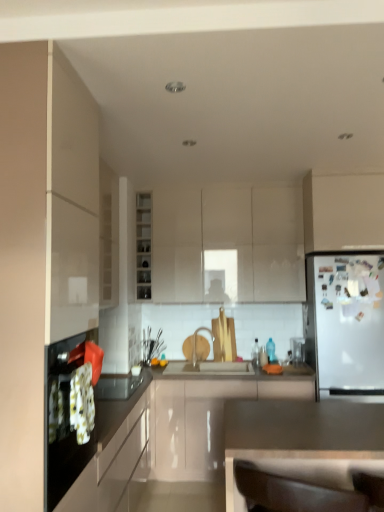
Question: Is matte white cabinet at center, the 5th cabinetry from the front, at the left side of glossy white countertop at lower center, positioned as the 1th countertop in back-to-front order?

Choices:
 (A) yes
 (B) no

Answer: (B)

Question: From a real-world perspective, is matte white cabinet at center, the 5th cabinetry from the front, located beneath glossy white countertop at lower center, positioned as the 1th countertop in back-to-front order?

Choices:
 (A) yes
 (B) no

Answer: (B)

Question: Does matte white cabinet at center, the second cabinetry in the back-to-front sequence, turn towards glossy white countertop at lower center, arranged as the 2th countertop when viewed from the front?

Choices:
 (A) yes
 (B) no

Answer: (B)

Question: From the image's perspective, is matte white cabinet at center, the 5th cabinetry from the front, below glossy white countertop at lower center, arranged as the 2th countertop when viewed from the front?

Choices:
 (A) yes
 (B) no

Answer: (B)

Question: From a real-world perspective, is matte white cabinet at center, the 5th cabinetry from the front, over glossy white countertop at lower center, arranged as the 2th countertop when viewed from the front?

Choices:
 (A) yes
 (B) no

Answer: (A)

Question: From the image's perspective, is white glossy cabinet at upper right, which is the fourth cabinetry in back-to-front order, located above or below matte gray countertop at center, the first countertop viewed from the front?

Choices:
 (A) above
 (B) below

Answer: (A)

Question: Is white glossy cabinet at upper right, the third cabinetry when ordered from front to back, in front of or behind matte gray countertop at center, acting as the 2th countertop starting from the back, in the image?

Choices:
 (A) front
 (B) behind

Answer: (B)

Question: In terms of size, does white glossy cabinet at upper right, which is the fourth cabinetry in back-to-front order, appear bigger or smaller than matte gray countertop at center, acting as the 2th countertop starting from the back?

Choices:
 (A) big
 (B) small

Answer: (B)

Question: From a real-world perspective, is white glossy cabinet at upper right, the third cabinetry when ordered from front to back, above or below matte gray countertop at center, acting as the 2th countertop starting from the back?

Choices:
 (A) below
 (B) above

Answer: (B)

Question: In terms of size, does glossy white countertop at lower center, arranged as the 2th countertop when viewed from the front, appear bigger or smaller than white matte refrigerator at right?

Choices:
 (A) big
 (B) small

Answer: (A)

Question: Is glossy white countertop at lower center, arranged as the 2th countertop when viewed from the front, taller or shorter than white matte refrigerator at right?

Choices:
 (A) short
 (B) tall

Answer: (A)

Question: Do you think glossy white countertop at lower center, positioned as the 1th countertop in back-to-front order, is within white matte refrigerator at right, or outside of it?

Choices:
 (A) inside
 (B) outside

Answer: (B)

Question: Considering the relative positions of glossy white countertop at lower center, arranged as the 2th countertop when viewed from the front, and white matte refrigerator at right in the image provided, is glossy white countertop at lower center, arranged as the 2th countertop when viewed from the front, to the left or to the right of white matte refrigerator at right?

Choices:
 (A) left
 (B) right

Answer: (A)

Question: Considering the positions of glossy white cabinet at center, positioned as the third cabinetry in back-to-front order, and white glossy cabinet at center, acting as the first cabinetry starting from the back, in the image, is glossy white cabinet at center, positioned as the third cabinetry in back-to-front order, taller or shorter than white glossy cabinet at center, acting as the first cabinetry starting from the back,?

Choices:
 (A) short
 (B) tall

Answer: (A)

Question: In terms of size, does glossy white cabinet at center, which is the 4th cabinetry in front-to-back order, appear bigger or smaller than white glossy cabinet at center, acting as the first cabinetry starting from the back?

Choices:
 (A) big
 (B) small

Answer: (A)